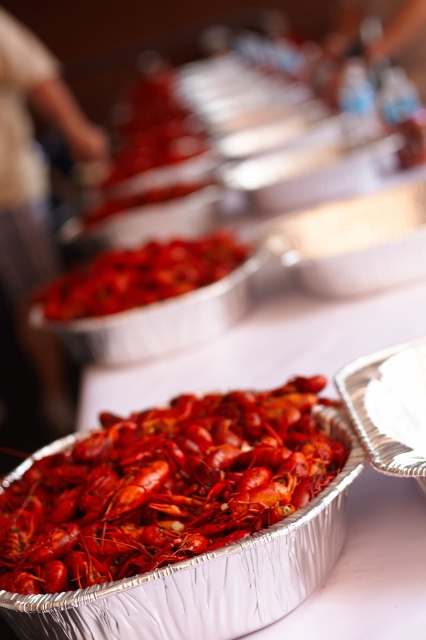
Does point (192, 540) come farther from viewer compared to point (69, 285)?

No, it is in front of (69, 285).

Who is positioned more to the left, shiny red lobster at center or bright red crayfish at center?

From the viewer's perspective, bright red crayfish at center appears more on the left side.

The image size is (426, 640). Describe the element at coordinates (164, 486) in the screenshot. I see `shiny red lobster at center` at that location.

Where is `shiny red lobster at center`? This screenshot has width=426, height=640. shiny red lobster at center is located at coordinates (164, 486).